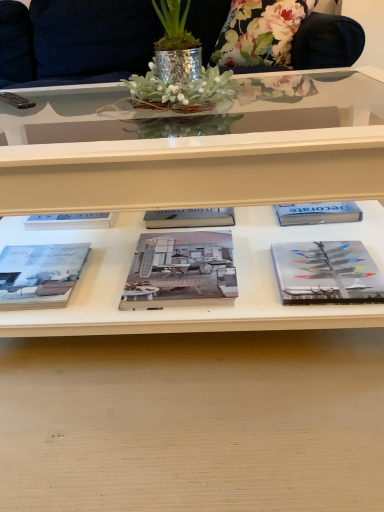
Question: Looking at their shapes, would you say shiny metallic pot at center is wider or thinner than matte gray book at lower left, marked as the third book in a right-to-left arrangement?

Choices:
 (A) thin
 (B) wide

Answer: (B)

Question: Is point (145, 79) closer or farther from the camera than point (87, 252)?

Choices:
 (A) farther
 (B) closer

Answer: (B)

Question: Estimate the real-world distances between objects in this image. Which object is closer to the shiny metallic pot at center?

Choices:
 (A) matte gray book at center, which is counted as the second book, starting from the left
 (B) wooden desk at center
 (C) matte gray book at lower left, which is the 1th book in left-to-right order
 (D) black plastic remote control at upper left
 (E) gray matte book at right, acting as the 1th book starting from the right

Answer: (A)

Question: Which is nearer to the matte gray book at center, positioned as the second book in right-to-left order?

Choices:
 (A) matte gray book at lower left, which is the 1th book in left-to-right order
 (B) shiny metallic pot at center
 (C) wooden desk at center
 (D) floral fabric pillow at upper center
 (E) gray matte book at right, which is the 3th book from left to right

Answer: (C)